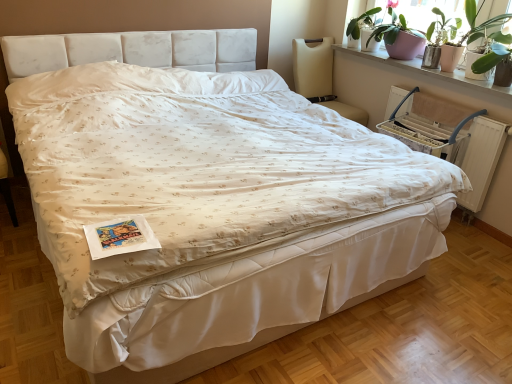
Question: Is beige fabric chair at upper right oriented towards matte white window screen at upper right?

Choices:
 (A) yes
 (B) no

Answer: (B)

Question: Is beige fabric chair at upper right bigger than matte white window screen at upper right?

Choices:
 (A) yes
 (B) no

Answer: (A)

Question: Is matte white window screen at upper right inside beige fabric chair at upper right?

Choices:
 (A) no
 (B) yes

Answer: (A)

Question: Are beige fabric chair at upper right and matte white window screen at upper right making contact?

Choices:
 (A) yes
 (B) no

Answer: (B)

Question: Considering the relative sizes of beige fabric chair at upper right and matte white window screen at upper right in the image provided, is beige fabric chair at upper right wider than matte white window screen at upper right?

Choices:
 (A) no
 (B) yes

Answer: (B)

Question: Considering the positions of point (428, 6) and point (473, 71), is point (428, 6) closer or farther from the camera than point (473, 71)?

Choices:
 (A) closer
 (B) farther

Answer: (B)

Question: Is matte white window screen at upper right wider or thinner than green leafy plant at upper right?

Choices:
 (A) thin
 (B) wide

Answer: (B)

Question: From the image's perspective, relative to green leafy plant at upper right, is matte white window screen at upper right above or below?

Choices:
 (A) below
 (B) above

Answer: (B)

Question: From their relative heights in the image, would you say matte white window screen at upper right is taller or shorter than green leafy plant at upper right?

Choices:
 (A) short
 (B) tall

Answer: (B)

Question: Is point (437, 11) closer or farther from the camera than point (352, 112)?

Choices:
 (A) farther
 (B) closer

Answer: (B)

Question: Is matte white window screen at upper right taller or shorter than beige fabric chair at upper right?

Choices:
 (A) tall
 (B) short

Answer: (B)

Question: From a real-world perspective, relative to beige fabric chair at upper right, is matte white window screen at upper right vertically above or below?

Choices:
 (A) above
 (B) below

Answer: (A)

Question: Is matte white window screen at upper right in front of or behind beige fabric chair at upper right in the image?

Choices:
 (A) behind
 (B) front

Answer: (B)

Question: From the image's perspective, is green leafy plant at upper right above or below beige fabric chair at upper right?

Choices:
 (A) below
 (B) above

Answer: (A)

Question: Looking at the image, does green leafy plant at upper right seem bigger or smaller compared to beige fabric chair at upper right?

Choices:
 (A) small
 (B) big

Answer: (A)